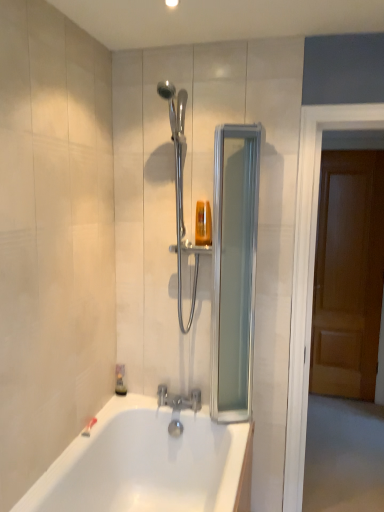
Question: Can you confirm if polished chrome shower head at upper center is bigger than brown wooden door at right?

Choices:
 (A) no
 (B) yes

Answer: (A)

Question: Is polished chrome shower head at upper center not near brown wooden door at right?

Choices:
 (A) yes
 (B) no

Answer: (A)

Question: Can we say polished chrome shower head at upper center lies outside brown wooden door at right?

Choices:
 (A) yes
 (B) no

Answer: (A)

Question: Is brown wooden door at right a part of polished chrome shower head at upper center?

Choices:
 (A) no
 (B) yes

Answer: (A)

Question: Considering the relative positions of polished chrome shower head at upper center and brown wooden door at right in the image provided, is polished chrome shower head at upper center to the right of brown wooden door at right from the viewer's perspective?

Choices:
 (A) yes
 (B) no

Answer: (B)

Question: Considering the relative sizes of polished chrome shower head at upper center and brown wooden door at right in the image provided, is polished chrome shower head at upper center shorter than brown wooden door at right?

Choices:
 (A) yes
 (B) no

Answer: (A)

Question: Is translucent plastic soap dispenser at upper center not inside silver metallic faucet at lower center?

Choices:
 (A) no
 (B) yes

Answer: (B)

Question: Does translucent plastic soap dispenser at upper center turn towards silver metallic faucet at lower center?

Choices:
 (A) no
 (B) yes

Answer: (A)

Question: From a real-world perspective, does translucent plastic soap dispenser at upper center sit lower than silver metallic faucet at lower center?

Choices:
 (A) no
 (B) yes

Answer: (A)

Question: Is silver metallic faucet at lower center completely or partially inside translucent plastic soap dispenser at upper center?

Choices:
 (A) yes
 (B) no

Answer: (B)

Question: Is translucent plastic soap dispenser at upper center wider than silver metallic faucet at lower center?

Choices:
 (A) yes
 (B) no

Answer: (B)

Question: Is translucent plastic soap dispenser at upper center in front of silver metallic faucet at lower center?

Choices:
 (A) no
 (B) yes

Answer: (B)

Question: Can you confirm if silver metallic faucet at lower center is wider than translucent plastic soap dispenser at lower left?

Choices:
 (A) no
 (B) yes

Answer: (B)